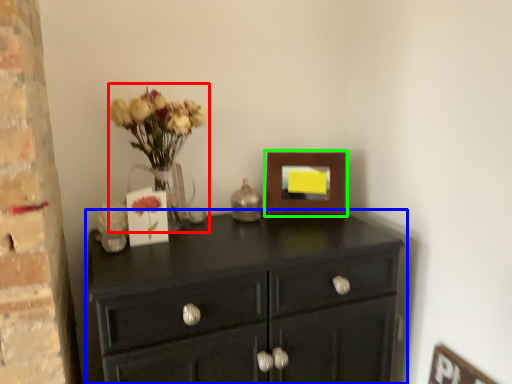
Question: Which object is positioned farthest from floral arrangement (highlighted by a red box)? Select from chest of drawers (highlighted by a blue box) and picture frame (highlighted by a green box).

Choices:
 (A) chest of drawers
 (B) picture frame

Answer: (B)